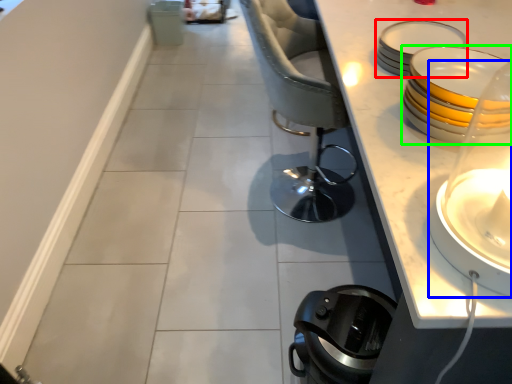
Question: Which is nearer to the tableware (highlighted by a red box)? candle holder (highlighted by a blue box) or tableware (highlighted by a green box).

Choices:
 (A) candle holder
 (B) tableware

Answer: (B)